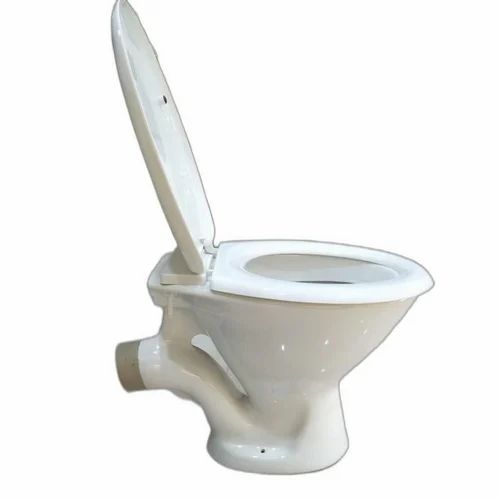
I want to click on empty space above toilet, so click(x=340, y=137).